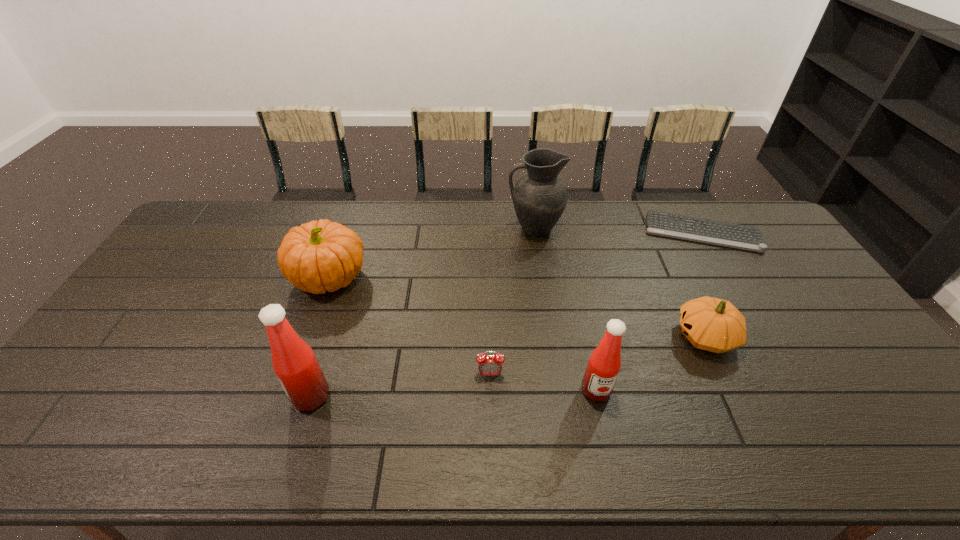
The width and height of the screenshot is (960, 540). What are the coordinates of `the taller condiment` in the screenshot? It's located at (293, 360).

This screenshot has height=540, width=960. Find the location of `the fifth shortest object`. the fifth shortest object is located at coordinates [x=604, y=364].

The height and width of the screenshot is (540, 960). In order to click on the right condiment in this screenshot , I will do `click(604, 364)`.

The image size is (960, 540). Identify the location of the shortest object. (744, 237).

The image size is (960, 540). In order to click on pitcher in this screenshot , I will do `click(539, 197)`.

Find the location of a particular element. The width and height of the screenshot is (960, 540). the fourth tallest object is located at coordinates (319, 256).

The height and width of the screenshot is (540, 960). Identify the location of gourd. (711, 324).

Find the location of `the fourth nearest object`. the fourth nearest object is located at coordinates (711, 324).

The height and width of the screenshot is (540, 960). Find the location of `the third object from left to right`. the third object from left to right is located at coordinates click(x=489, y=365).

Where is `alarm clock`? Image resolution: width=960 pixels, height=540 pixels. alarm clock is located at coordinates (489, 365).